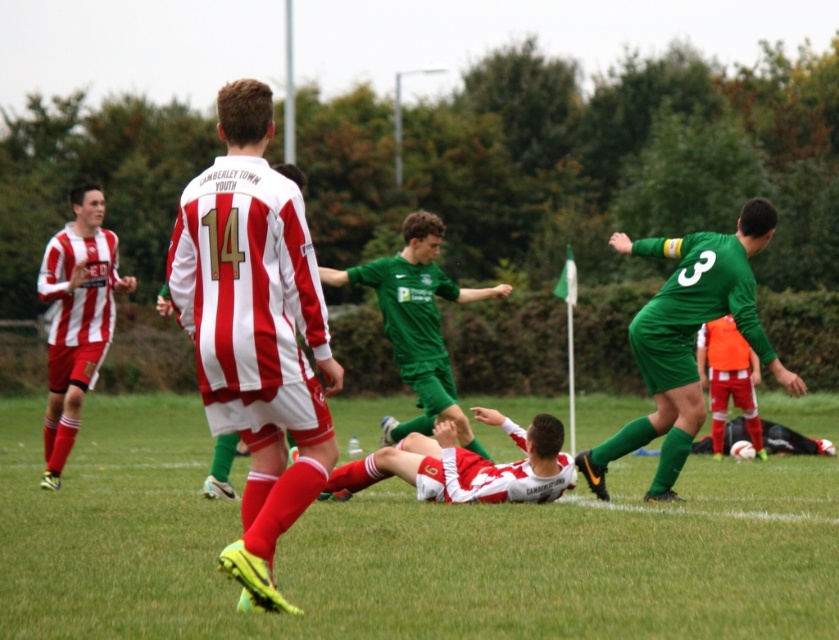
Locate an element on the screen. The height and width of the screenshot is (640, 839). white and red striped jersey at center is located at coordinates (254, 330).

Does point (306, 275) lie behind point (92, 189)?

No.

Locate an element on the screen. white and red striped jersey at center is located at coordinates (254, 330).

From the picture: Who is taller, white and red striped jersey at center or green jersey at center?

green jersey at center

In the scene shown: Which is above, white and red striped jersey at center or green jersey at center?

green jersey at center is higher up.

Which is behind, point (288, 412) or point (433, 284)?

Point (433, 284)

Find the location of a particular element. white and red striped jersey at center is located at coordinates (254, 330).

Is green grass football field at center in front of green jersey at center?

Yes, it is.

Which of these two, green grass football field at center or green jersey at center, stands taller?

green jersey at center

Between point (645, 589) and point (436, 369), which one is positioned behind?

The point (436, 369) is more distant.

Image resolution: width=839 pixels, height=640 pixels. I want to click on green grass football field at center, so click(405, 547).